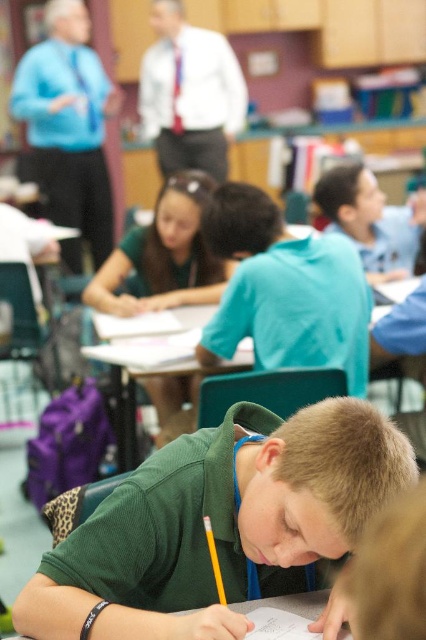
Question: Which of the following is the farthest from the observer?

Choices:
 (A) wooden desk at center
 (B) white paper at lower center
 (C) green matte shirt at center

Answer: (A)

Question: Is wooden desk at center to the right of white paper at lower center from the viewer's perspective?

Choices:
 (A) no
 (B) yes

Answer: (B)

Question: Which object is farther from the camera taking this photo?

Choices:
 (A) wooden desk at center
 (B) white paper at lower center

Answer: (A)

Question: Is wooden desk at center positioned behind white paper at lower center?

Choices:
 (A) no
 (B) yes

Answer: (B)

Question: Does green matte shirt at center lie behind white paper at lower center?

Choices:
 (A) no
 (B) yes

Answer: (A)

Question: Which point is farther from the camera taking this photo?

Choices:
 (A) (52, 564)
 (B) (255, 604)

Answer: (B)